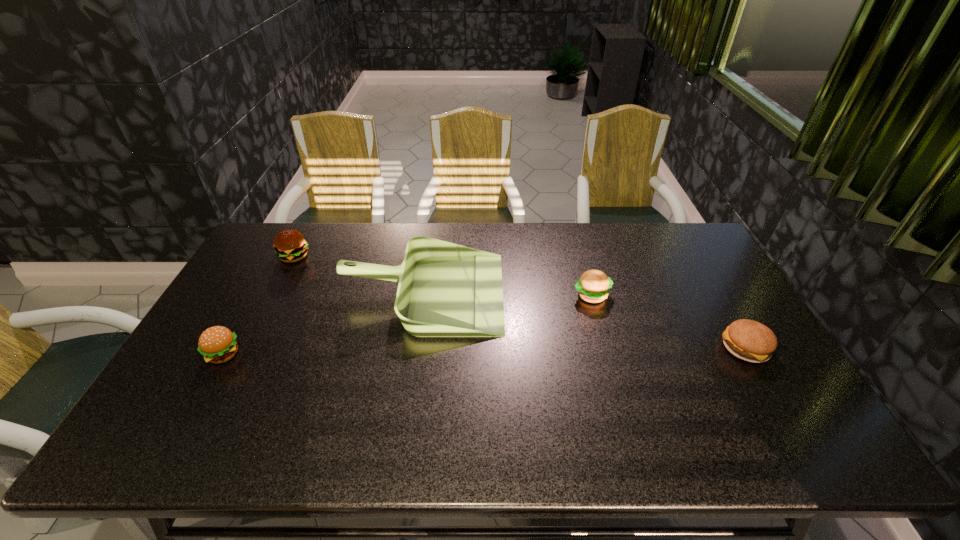
Image resolution: width=960 pixels, height=540 pixels. Identify the location of dustpan. (445, 290).

Find the location of a particular element. The height and width of the screenshot is (540, 960). the third object from left to right is located at coordinates (445, 290).

You are a GUI agent. You are given a task and a screenshot of the screen. Output one action in this format:
    pyautogui.click(x=<x>, y=<y>)
    Task: Click on the farthest hamburger
    
    Given the screenshot: What is the action you would take?
    pyautogui.click(x=290, y=245)

Identify the location of the fourth object from left to right. (x=593, y=286).

Image resolution: width=960 pixels, height=540 pixels. In order to click on the second hamburger from right to left in this screenshot , I will do `click(593, 286)`.

At what (x,y) coordinates should I click in order to perform the action: click on the rightmost hamburger. Please return your answer as a coordinate pair (x, y). The width and height of the screenshot is (960, 540). Looking at the image, I should click on (748, 340).

Identify the location of the rightmost object. The height and width of the screenshot is (540, 960). (748, 340).

Locate an element on the screen. The width and height of the screenshot is (960, 540). vacant space positioned on the scoop of the third object from left to right is located at coordinates (583, 292).

Identify the location of vacant space located 0.170m on the right of the farthest hamburger. Image resolution: width=960 pixels, height=540 pixels. click(x=359, y=256).

This screenshot has height=540, width=960. I want to click on vacant space located on the back of the fourth object from left to right, so click(x=585, y=268).